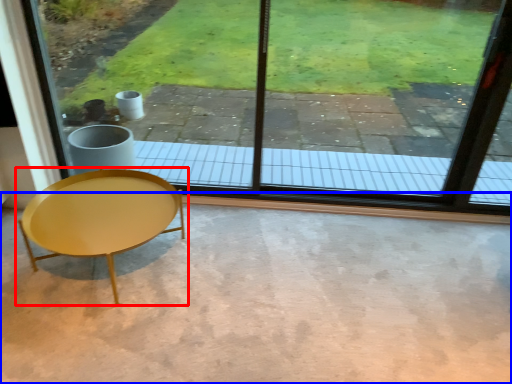
Question: Which point is closer to the camera, coffee table (highlighted by a red box) or concrete (highlighted by a blue box)?

Choices:
 (A) coffee table
 (B) concrete

Answer: (B)